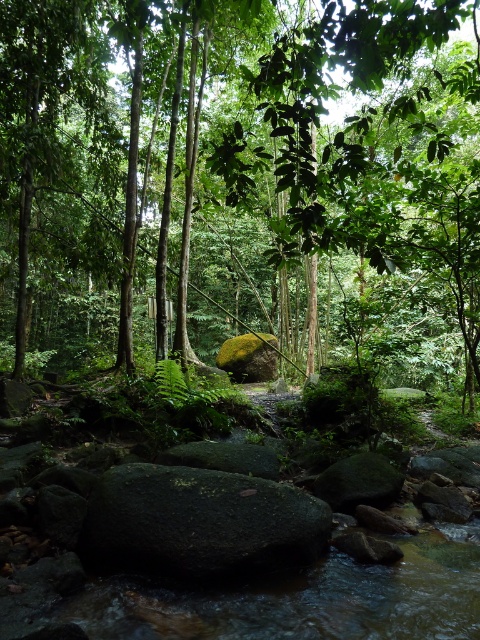
Is green leafy tree at center below green mossy rock at center?

Actually, green leafy tree at center is above green mossy rock at center.

Consider the image. Which is below, green leafy tree at center or green mossy rock at center?

green mossy rock at center is below.

Between point (437, 305) and point (122, 483), which one is positioned in front?

Point (122, 483) is more forward.

Locate an element on the screen. green leafy tree at center is located at coordinates (241, 145).